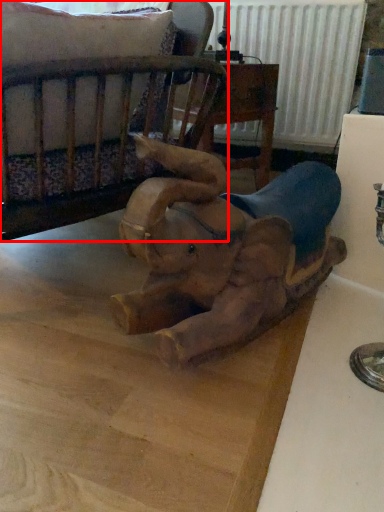
Question: From the image's perspective, considering the relative positions of furniture (annotated by the red box) and elephant in the image provided, where is furniture (annotated by the red box) located with respect to the staircase?

Choices:
 (A) below
 (B) above

Answer: (B)